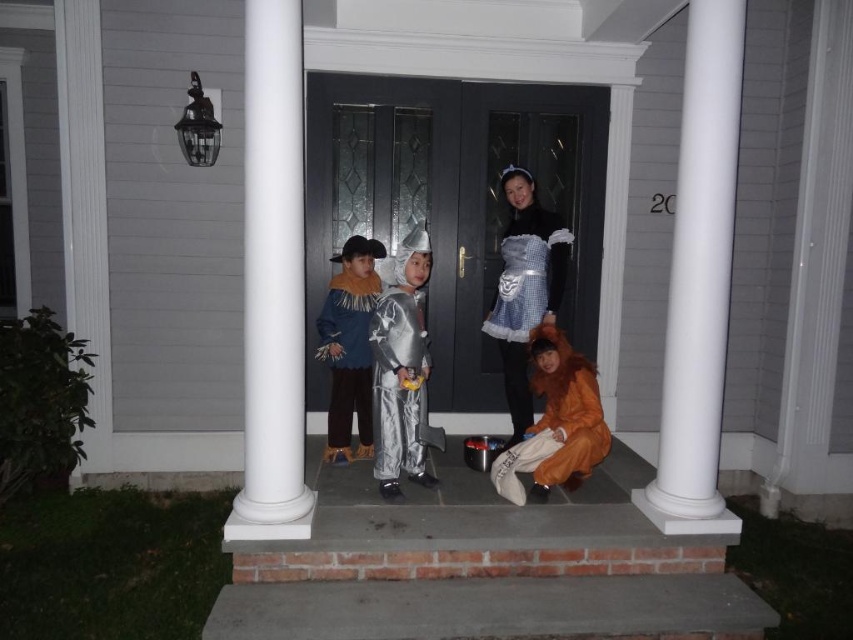
Question: Among these points, which one is farthest from the camera?

Choices:
 (A) (714, 3)
 (B) (553, 333)
 (C) (407, 344)

Answer: (B)

Question: Is the position of white gingham dress at center less distant than that of blue felt coat at center?

Choices:
 (A) no
 (B) yes

Answer: (B)

Question: Does white gingham dress at center have a larger size compared to orange plush costume at lower right?

Choices:
 (A) no
 (B) yes

Answer: (B)

Question: Which object is positioned farthest from the white smooth column at right?

Choices:
 (A) orange plush costume at lower right
 (B) white gingham dress at center
 (C) shiny silver costume at center

Answer: (C)

Question: Which point is farther to the camera?

Choices:
 (A) white smooth column at center
 (B) white gingham dress at center

Answer: (B)

Question: Does shiny silver costume at center have a smaller size compared to white gingham dress at center?

Choices:
 (A) no
 (B) yes

Answer: (B)